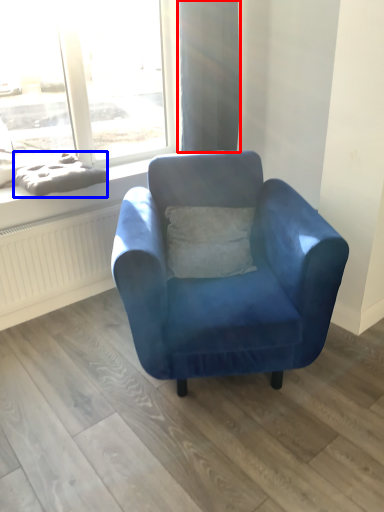
Question: Among these objects, which one is nearest to the camera, curtain (highlighted by a red box) or material (highlighted by a blue box)?

Choices:
 (A) curtain
 (B) material

Answer: (B)